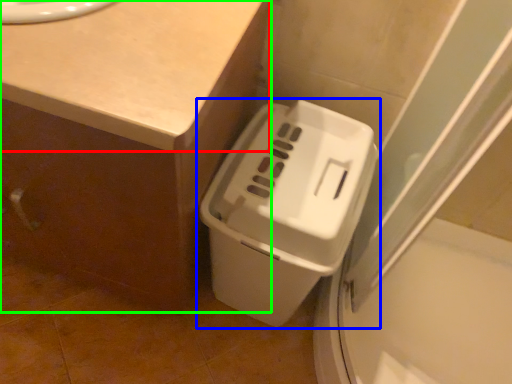
Question: Estimate the real-world distances between objects in this image. Which object is farther from counter top (highlighted by a red box), waste container (highlighted by a blue box) or counter (highlighted by a green box)?

Choices:
 (A) waste container
 (B) counter

Answer: (A)